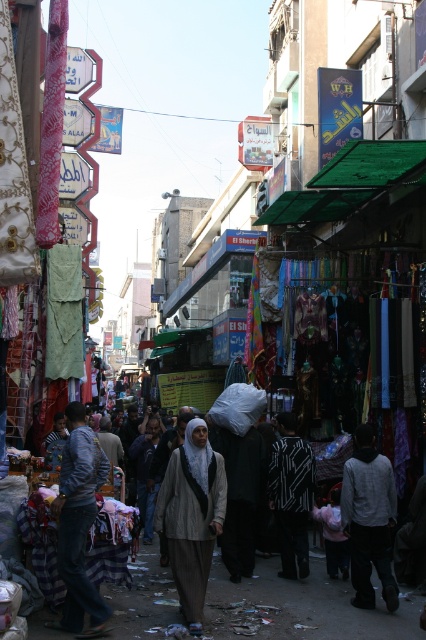
You are a tourist standing in the middle of the bustling street market. You notice two items for sale at the center of the scene. Which item is closer to you, the light brown fabric hijab at center or the dark gray hoodie at center?

The light brown fabric hijab at center is closer to you because it is further to the viewer than the dark gray hoodie at center.

You are a photographer standing at the camera position. You want to capture a photo of the light brown fabric hijab at center. Given that your camera has a maximum focus range of 30 meters, will you be able to focus on the hijab?

The light brown fabric hijab at center and camera are 35.22 meters apart from each other. Since the distance exceeds the camera maximum focus range of 30 meters, you will not be able to focus on the hijab.

You are a delivery person needing to navigate through the crowded market street. You must pass between the light brown fabric hijab at center and the dark gray hoodie at center. What is the minimum width your delivery cart requires to safely pass through this space?

The distance between the light brown fabric hijab at center and the dark gray hoodie at center is 34.52 feet. Therefore, the delivery cart must be no wider than 34.52 feet to safely pass through this space.